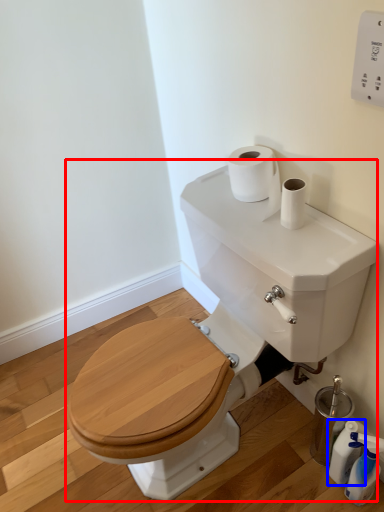
Question: Which point is closer to the camera, sink (highlighted by a red box) or cleaning product (highlighted by a blue box)?

Choices:
 (A) sink
 (B) cleaning product

Answer: (A)